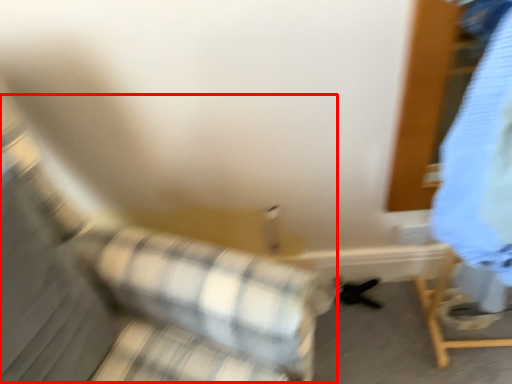
Question: From the image's perspective, where is couch (annotated by the red box) located relative to clothing?

Choices:
 (A) below
 (B) above

Answer: (A)